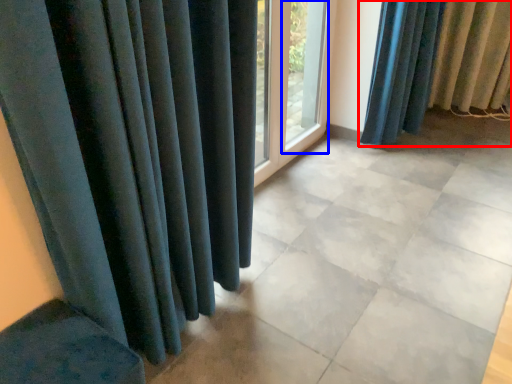
Question: Among these objects, which one is farthest to the camera, curtain (highlighted by a red box) or window frame (highlighted by a blue box)?

Choices:
 (A) curtain
 (B) window frame

Answer: (A)